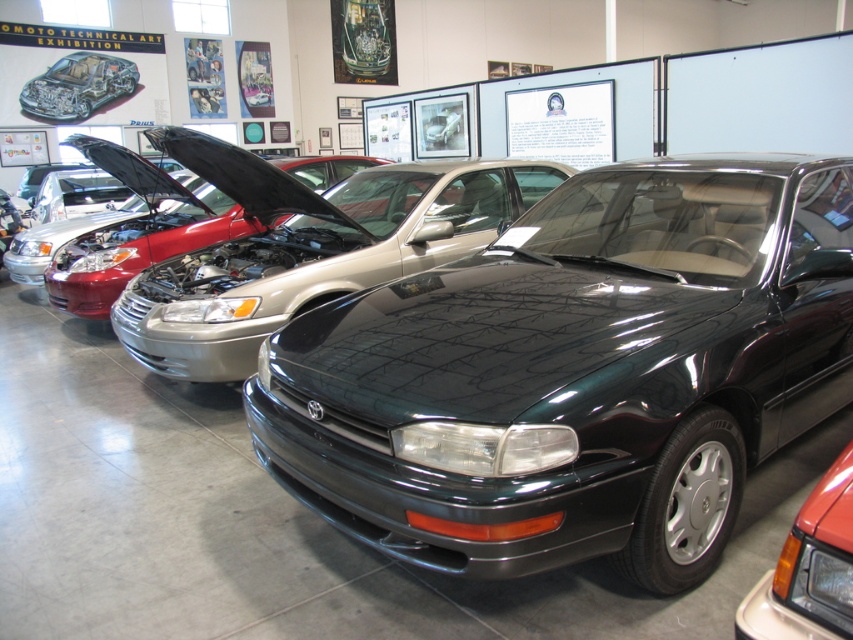
Question: Which of the following is the closest to the observer?

Choices:
 (A) glossy dark green car at center
 (B) matte black car at center

Answer: (A)

Question: Where is glossy dark green car at center located in relation to matte black car at center in the image?

Choices:
 (A) below
 (B) above

Answer: (A)

Question: Can you confirm if glossy dark green car at center is positioned to the right of matte black car at center?

Choices:
 (A) yes
 (B) no

Answer: (A)

Question: Which point is farther to the camera?

Choices:
 (A) glossy dark green car at center
 (B) matte black car at center

Answer: (B)

Question: From the image, what is the correct spatial relationship of glossy dark green car at center in relation to matte black car at center?

Choices:
 (A) above
 (B) below

Answer: (B)